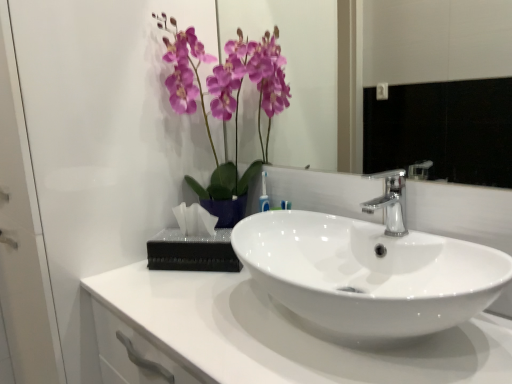
Question: Choose the correct answer: Is glossy ceramic mirror at upper center inside white glossy countertop at center or outside it?

Choices:
 (A) outside
 (B) inside

Answer: (A)

Question: Visually, is glossy ceramic mirror at upper center positioned to the left or to the right of white glossy countertop at center?

Choices:
 (A) left
 (B) right

Answer: (B)

Question: Which of these objects is positioned farthest from the white glossy countertop at center?

Choices:
 (A) purple glossy orchid at upper center
 (B) glossy ceramic mirror at upper center
 (C) translucent plastic tissue at center
 (D) transparent glass door at upper left
 (E) white glossy sink at center

Answer: (B)

Question: Which is nearer to the transparent glass door at upper left?

Choices:
 (A) purple glossy orchid at upper center
 (B) satin nickel faucet at center
 (C) glossy ceramic mirror at upper center
 (D) white glossy sink at center
 (E) translucent plastic tissue at center

Answer: (A)